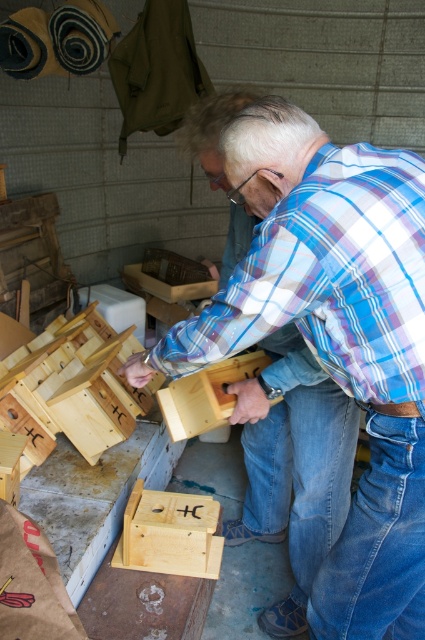
You are standing in the workshop and need to place a tool between the blue denim jeans at lower right and the blue denim jeans at lower center. Based on their positions, where should you place the tool?

Since the blue denim jeans at lower right is located above the blue denim jeans at lower center, you should place the tool below the blue denim jeans at lower right and above the blue denim jeans at lower center to position it between them.

You are standing in the workshop and need to reach the tool box located behind the blue denim jeans at lower center. Can you step around the blue denim jeans at lower right to access it?

Yes, because the blue denim jeans at lower right is in front of the blue denim jeans at lower center, you can step around the blue denim jeans at lower right to access the tool box behind the blue denim jeans at lower center.